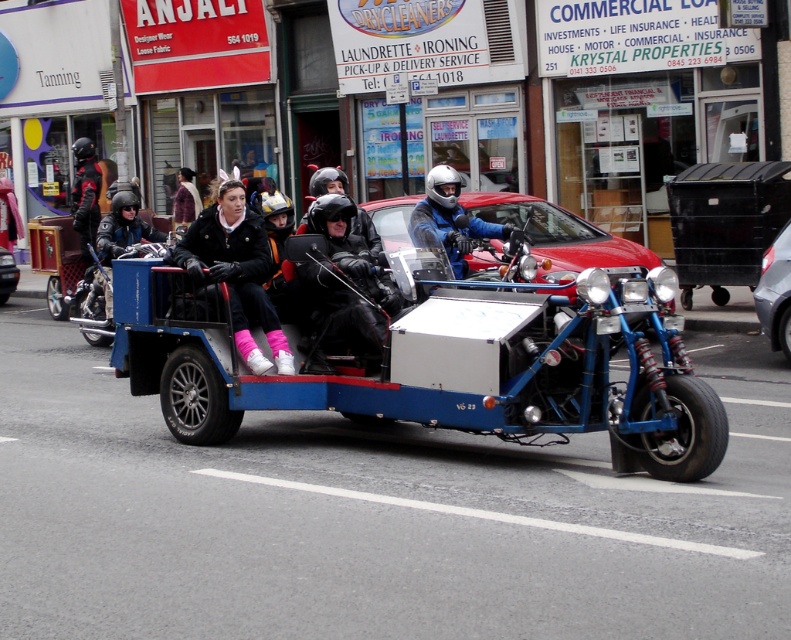
Based on the photo, you are a photographer trying to capture the custom vehicle in the scene. You notice both the blue metallic sidecar at center and the red matte car at center. Which one should you focus on if you want to photograph the larger object?

The blue metallic sidecar at center is bigger than the red matte car at center, so you should focus on the blue metallic sidecar at center to photograph the larger object.

You are a delivery person who needs to park your motorcycle near the metallic gray car at right. The parking spot is exactly at point 0.5, 0.981. Can you park your motorcycle there?

The metallic gray car at right is already parked at point (774, 292), which is very close to the desired parking spot at (774, 320). However, since the coordinates are not exactly the same, there might be enough space to park your motorcycle next to it, but you should check the distance between the two points to ensure safety and compliance with parking regulations.

You are a pedestrian standing on the sidewalk observing the scene. The red matte car at center and the plush purple coat at center are both in your line of sight. Which object appears taller from your perspective?

The plush purple coat at center appears taller than the red matte car at center because the red matte car at center has a lesser height compared to plush purple coat at center.